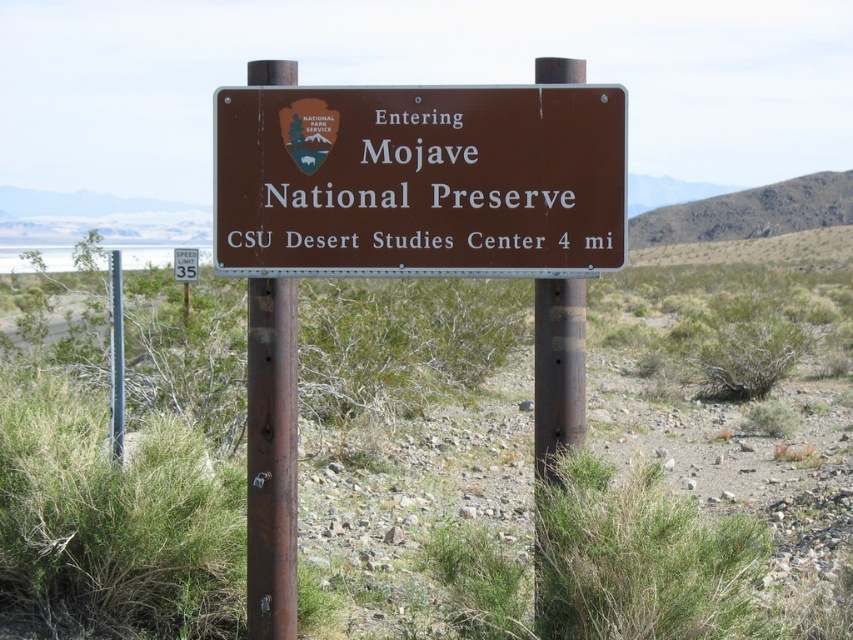
Question: Which object appears closest to the camera in this image?

Choices:
 (A) brown metallic sign at center
 (B) white plastic speed limit sign at upper center

Answer: (A)

Question: From the image, what is the correct spatial relationship of brown metallic sign at center in relation to white plastic speed limit sign at upper center?

Choices:
 (A) left
 (B) right

Answer: (B)

Question: Which object is farther from the camera taking this photo?

Choices:
 (A) white plastic speed limit sign at upper center
 (B) brown metallic sign at center

Answer: (A)

Question: Which point is farther from the camera taking this photo?

Choices:
 (A) (184, 259)
 (B) (585, 154)

Answer: (A)

Question: Is brown metallic sign at center in front of white plastic speed limit sign at upper center?

Choices:
 (A) no
 (B) yes

Answer: (B)

Question: Is brown metallic sign at center thinner than white plastic speed limit sign at upper center?

Choices:
 (A) no
 (B) yes

Answer: (B)